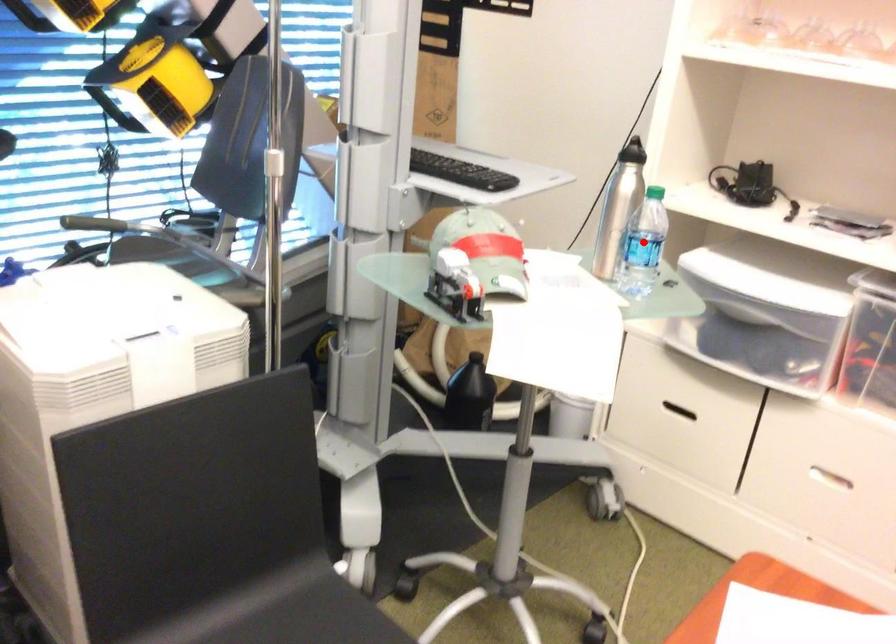
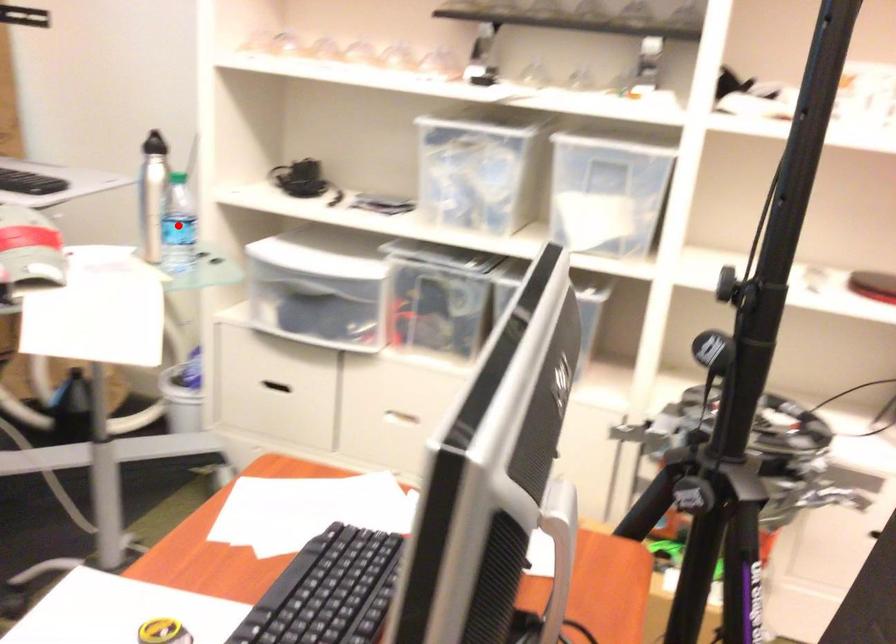
I am providing you with two images of the same scene from different viewpoints. A red point is marked on the first image and another point is marked on the second image. Is the marked point in image1 the same physical position as the marked point in image2?

Yes